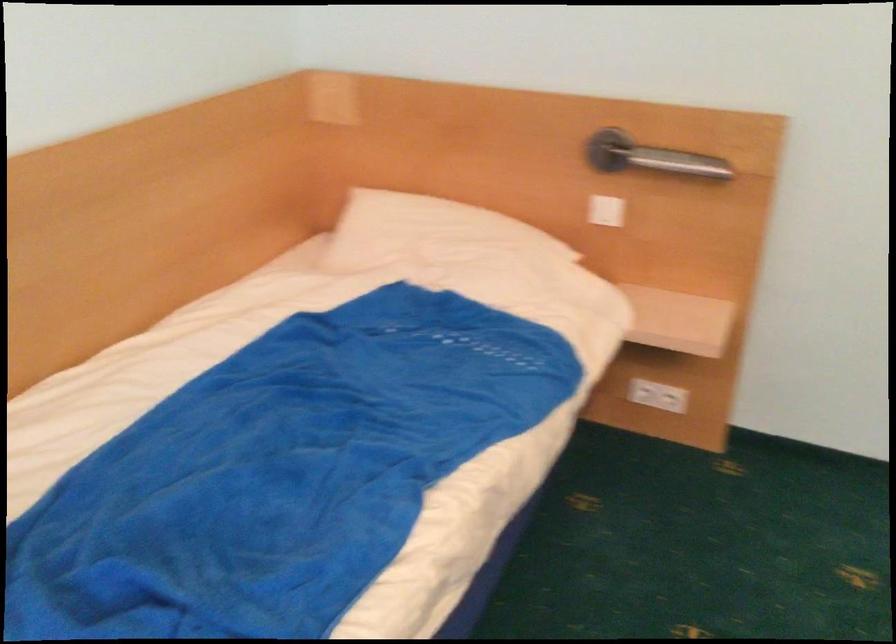
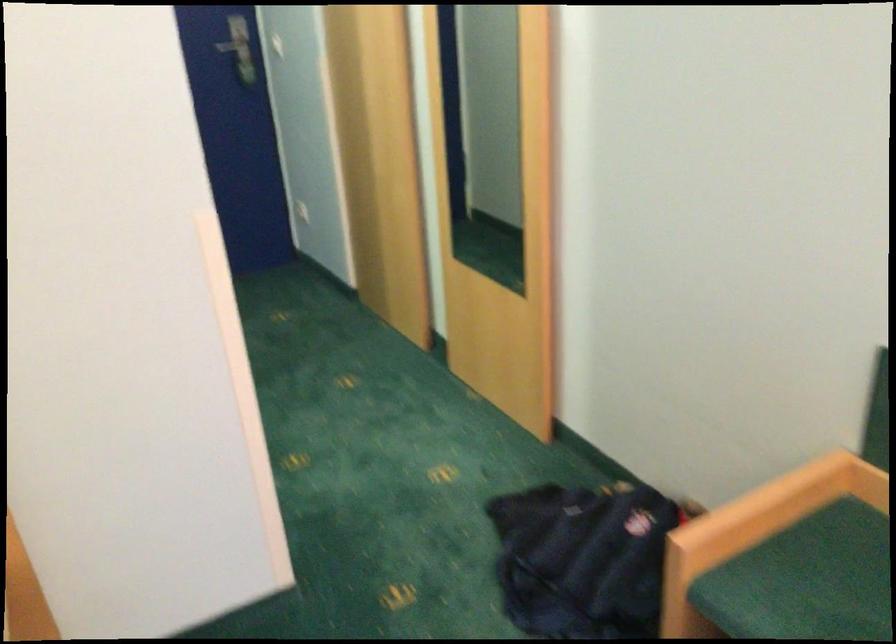
Question: The camera is either moving clockwise (left) or counter-clockwise (right) around the object. The first image is from the beginning of the video and the second image is from the end. Is the camera moving left or right when shooting the video?

Choices:
 (A) Left
 (B) Right

Answer: (A)